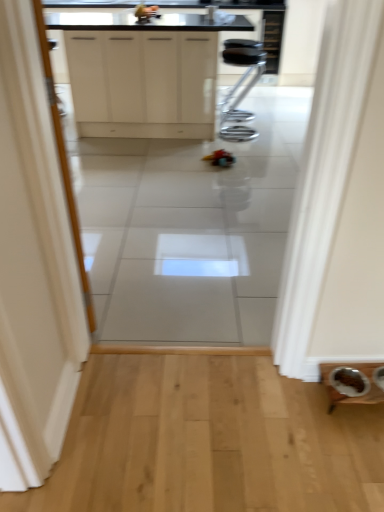
Question: Should I look upward or downward to see white matte cabinet at upper center?

Choices:
 (A) up
 (B) down

Answer: (A)

Question: Are black metal stool at center and white matte cabinet at upper center beside each other?

Choices:
 (A) yes
 (B) no

Answer: (B)

Question: Can you confirm if black metal stool at center is wider than white matte cabinet at upper center?

Choices:
 (A) yes
 (B) no

Answer: (B)

Question: Is black metal stool at center positioned before white matte cabinet at upper center?

Choices:
 (A) no
 (B) yes

Answer: (A)

Question: Can you confirm if black metal stool at center is taller than white matte cabinet at upper center?

Choices:
 (A) no
 (B) yes

Answer: (A)

Question: From a real-world perspective, is black metal stool at center positioned over white matte cabinet at upper center based on gravity?

Choices:
 (A) yes
 (B) no

Answer: (B)

Question: Does black metal stool at center appear on the right side of white matte cabinet at upper center?

Choices:
 (A) no
 (B) yes

Answer: (B)

Question: Considering the relative sizes of white matte cabinet at upper center and black metal stool at center in the image provided, is white matte cabinet at upper center wider than black metal stool at center?

Choices:
 (A) yes
 (B) no

Answer: (A)

Question: Is white matte cabinet at upper center located outside black metal stool at center?

Choices:
 (A) yes
 (B) no

Answer: (A)

Question: Is white matte cabinet at upper center taller than black metal stool at center?

Choices:
 (A) no
 (B) yes

Answer: (B)

Question: From a real-world perspective, is white matte cabinet at upper center on top of black metal stool at center?

Choices:
 (A) yes
 (B) no

Answer: (A)

Question: From the image's perspective, does white matte cabinet at upper center appear higher than black metal stool at center?

Choices:
 (A) yes
 (B) no

Answer: (A)

Question: From the image's perspective, is white matte cabinet at upper center beneath black metal stool at center?

Choices:
 (A) yes
 (B) no

Answer: (B)

Question: From the image's perspective, is black metal stool at center above or below white matte cabinet at upper center?

Choices:
 (A) below
 (B) above

Answer: (A)